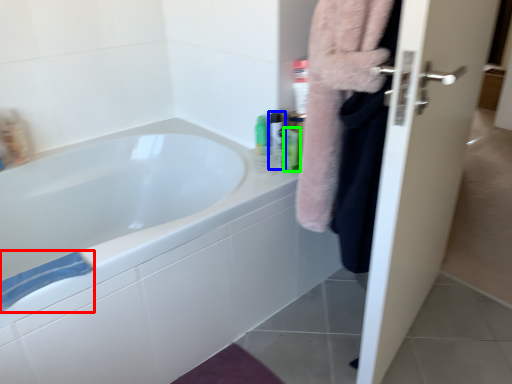
Question: Considering the real-world distances, which object is closest to bath towel (highlighted by a red box)? mouthwash (highlighted by a blue box) or mouthwash (highlighted by a green box).

Choices:
 (A) mouthwash
 (B) mouthwash

Answer: (A)